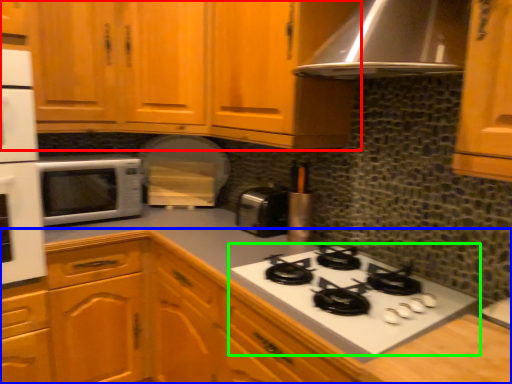
Question: Based on their relative distances, which object is nearer to cabinetry (highlighted by a red box)? Choose from cabinetry (highlighted by a blue box) and gas stove (highlighted by a green box).

Choices:
 (A) cabinetry
 (B) gas stove

Answer: (A)